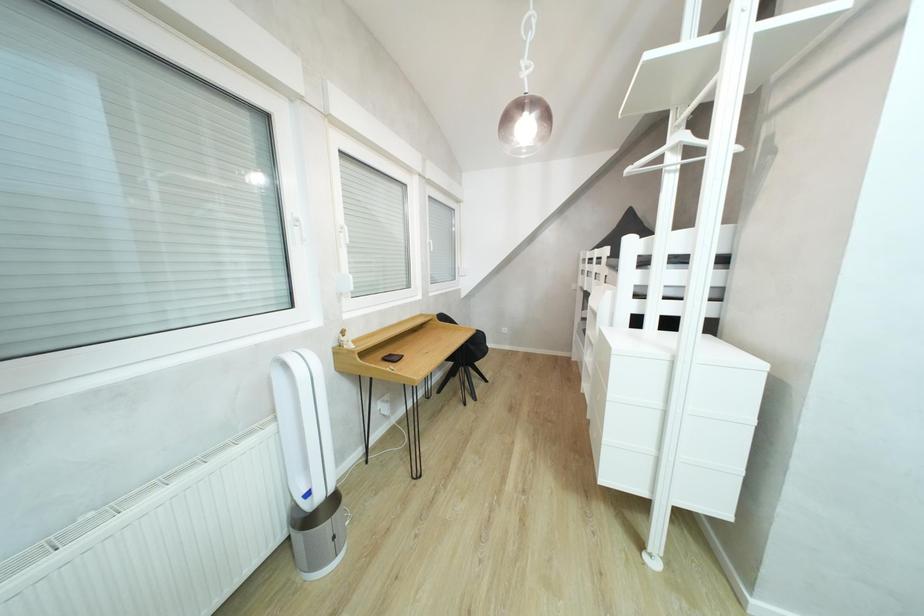
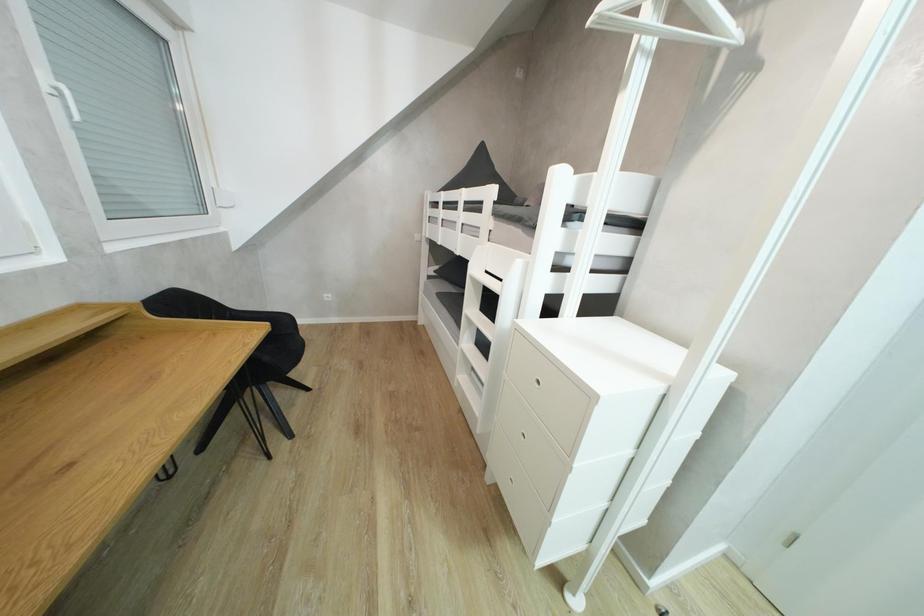
Question: Based on the continuous images, in which direction is the camera rotating? Reply with the corresponding letter.

Choices:
 (A) Left
 (B) Right
 (C) Up
 (D) Down

Answer: (B)